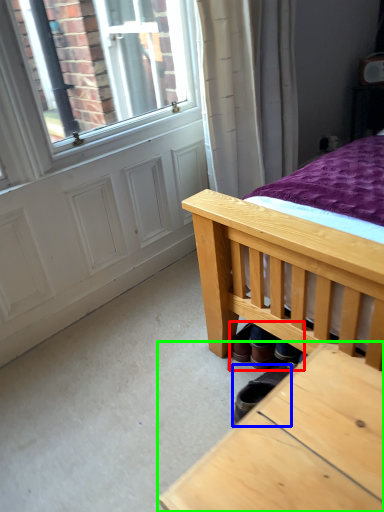
Question: Which object is positioned closest to shoe (highlighted by a red box)? Select from footwear (highlighted by a blue box) and table (highlighted by a green box).

Choices:
 (A) footwear
 (B) table

Answer: (A)